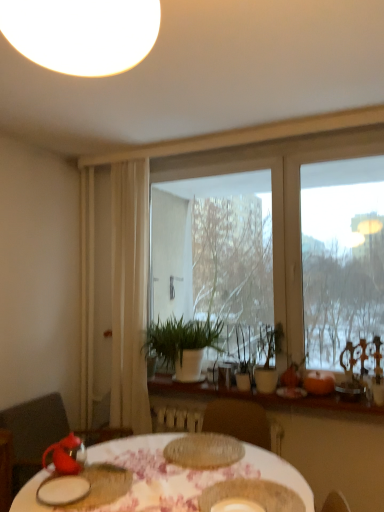
At what (x,y) coordinates should I click in order to perform the action: click on free space to the left of matte ceramic bowl at center, which is the 7th tableware from left to right. Please return your answer as a coordinate pair (x, y). Looking at the image, I should click on (162, 489).